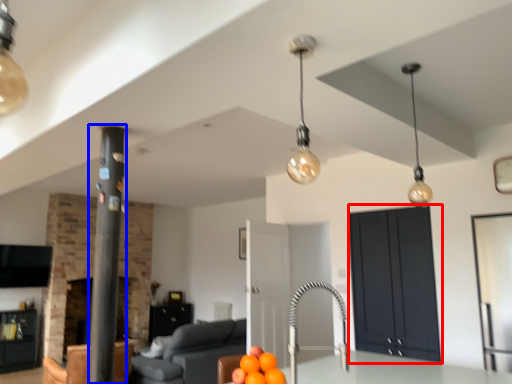
Question: Which object appears closest to the camera in this image, cabinetry (highlighted by a red box) or pillar (highlighted by a blue box)?

Choices:
 (A) cabinetry
 (B) pillar

Answer: (B)